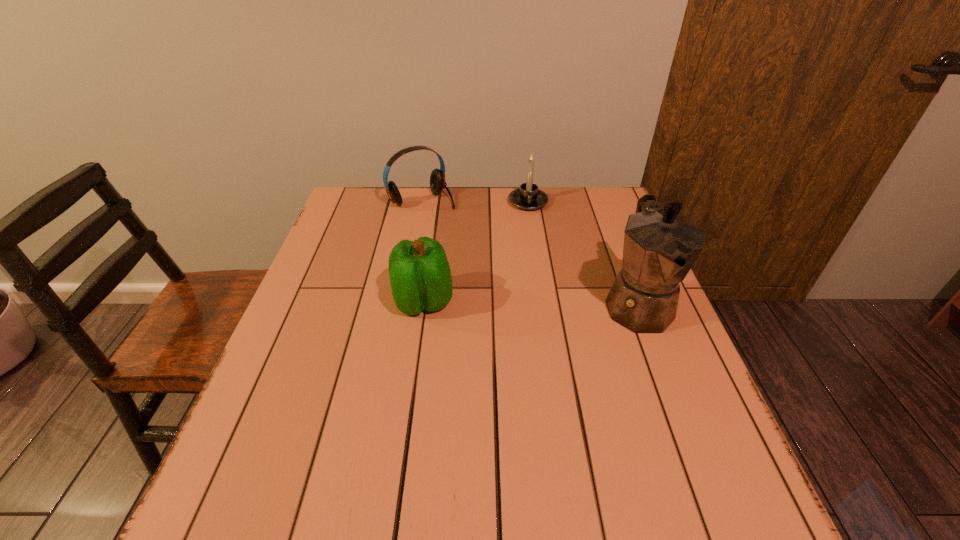
The width and height of the screenshot is (960, 540). I want to click on bell pepper, so click(x=420, y=276).

This screenshot has height=540, width=960. In order to click on coffeepot in this screenshot , I will do `click(660, 246)`.

The height and width of the screenshot is (540, 960). In order to click on the tallest object in this screenshot , I will do `click(660, 246)`.

This screenshot has width=960, height=540. Find the location of `the second object from right to left`. the second object from right to left is located at coordinates (528, 197).

The image size is (960, 540). I want to click on headset, so click(x=437, y=179).

What are the coordinates of `free location located 0.120m on the right of the bell pepper` in the screenshot? It's located at (503, 301).

Find the location of a particular element. The width and height of the screenshot is (960, 540). free space located 0.200m on the pouring side of the coffeepot is located at coordinates (685, 429).

This screenshot has width=960, height=540. In order to click on free location located with a handle on the side of the second object from right to left in this screenshot , I will do `click(531, 241)`.

At what (x,y) coordinates should I click in order to perform the action: click on vacant space located with a handle on the side of the second object from right to left. Please return your answer as a coordinate pair (x, y). Looking at the image, I should click on (534, 266).

Where is `free region located 0.230m with a handle on the side of the second object from right to left`? free region located 0.230m with a handle on the side of the second object from right to left is located at coordinates (533, 259).